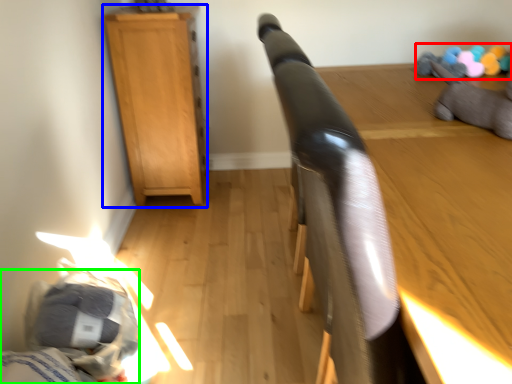
Question: Considering the real-world distances, which object is closest to toy (highlighted by a red box)? furniture (highlighted by a blue box) or bed (highlighted by a green box).

Choices:
 (A) furniture
 (B) bed

Answer: (A)